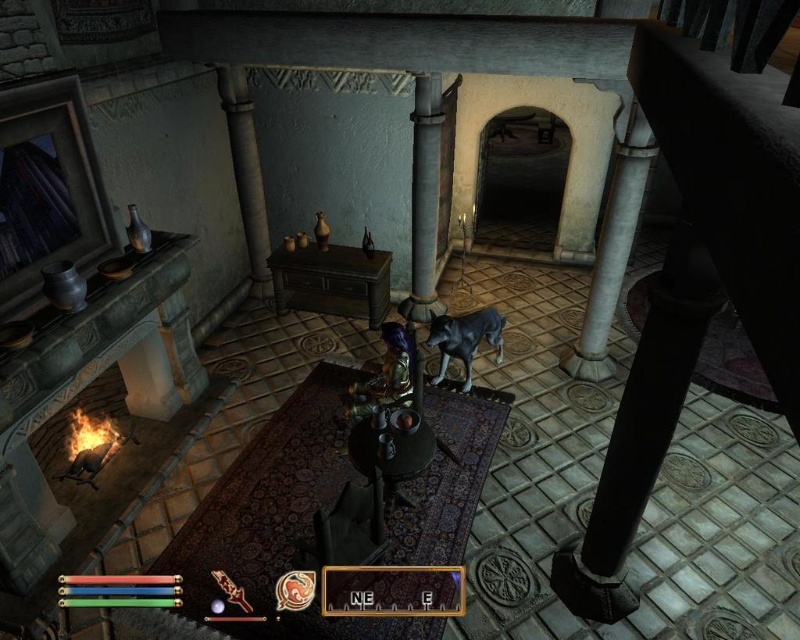
Question: Is black polished wood pillar at right bigger than white marble pillar at right?

Choices:
 (A) yes
 (B) no

Answer: (A)

Question: Among these points, which one is nearest to the camera?

Choices:
 (A) (621, 266)
 (B) (252, 259)
 (C) (641, 356)

Answer: (C)

Question: Which is nearer to the gray stone pillar at center?

Choices:
 (A) white marble pillar at right
 (B) black polished wood pillar at right

Answer: (A)

Question: Does white marble pillar at right come in front of gray stone pillar at center?

Choices:
 (A) yes
 (B) no

Answer: (A)

Question: Which point is closer to the camera?

Choices:
 (A) black polished wood pillar at right
 (B) white marble pillar at right

Answer: (A)

Question: Can you confirm if white marble pillar at right is bigger than gray stone pillar at center?

Choices:
 (A) no
 (B) yes

Answer: (B)